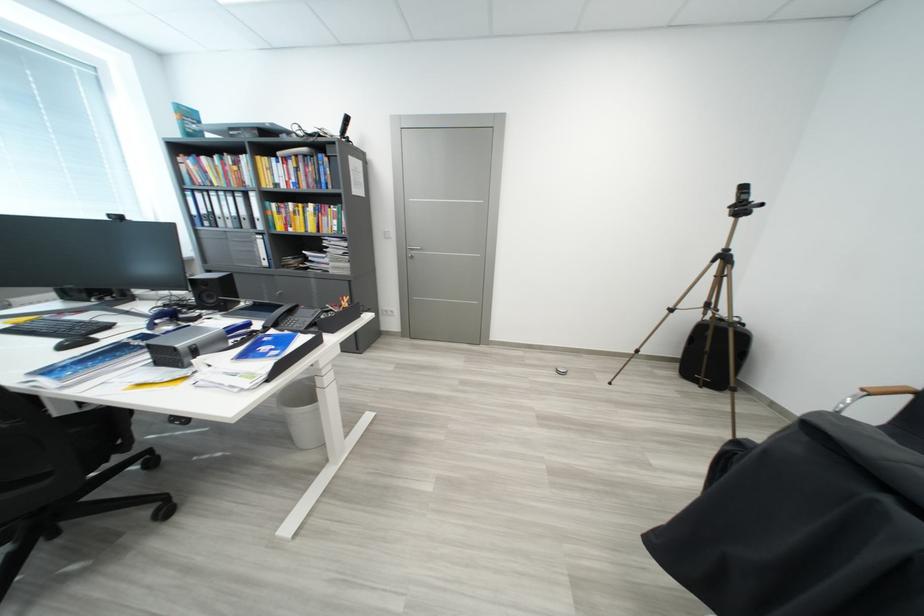
Locate an element on the screen. The image size is (924, 616). black speaker is located at coordinates pyautogui.click(x=213, y=291).